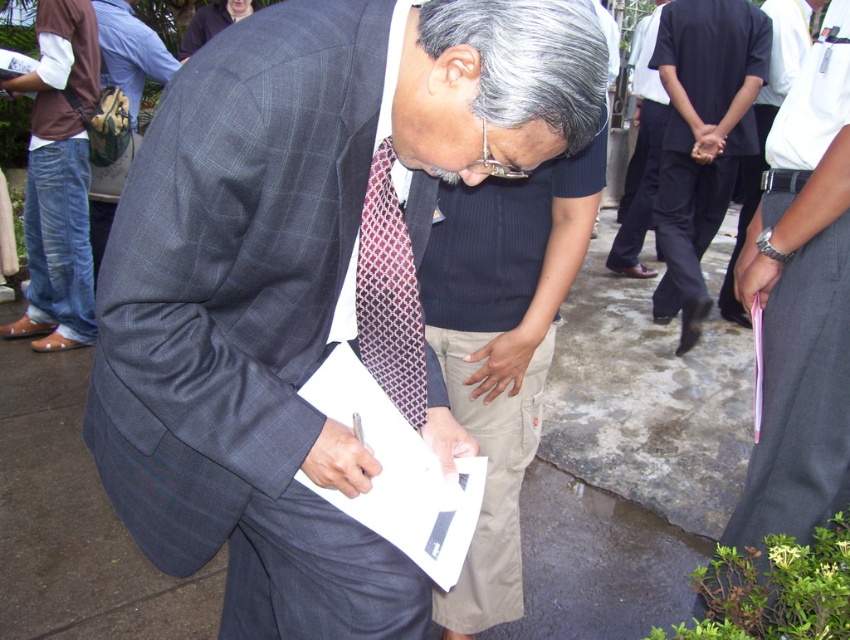
Question: Does matte gray suit at center have a larger size compared to black cotton pants at center?

Choices:
 (A) yes
 (B) no

Answer: (B)

Question: Is dark gray suit at center to the right of geometric patterned tie at center from the viewer's perspective?

Choices:
 (A) no
 (B) yes

Answer: (B)

Question: Which point is farther to the camera?

Choices:
 (A) (204, 282)
 (B) (37, 35)
 (C) (626, 250)

Answer: (C)

Question: Which of the following is the farthest from the observer?

Choices:
 (A) (647, 76)
 (B) (840, 358)
 (C) (697, 216)

Answer: (A)

Question: Is black cotton pants at center smaller than geometric patterned tie at center?

Choices:
 (A) yes
 (B) no

Answer: (B)

Question: Which of the following is the closest to the observer?

Choices:
 (A) geometric patterned tie at center
 (B) plaid wool suit at center
 (C) matte gray suit at center

Answer: (C)